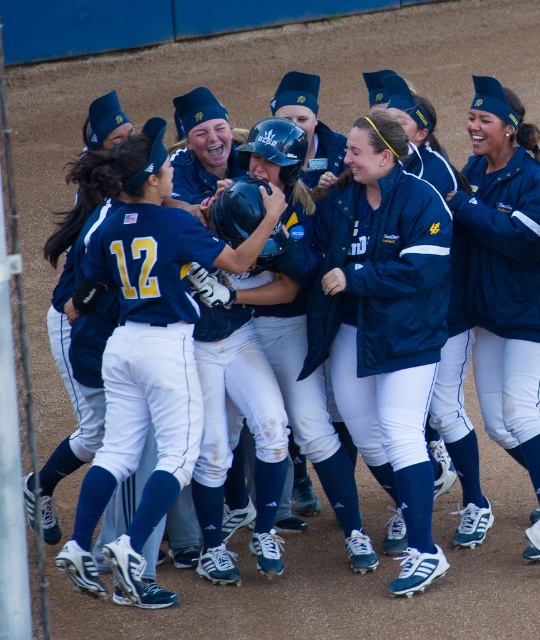
You are a photographer standing at the edge of the field. You want to take a photo of both the blue matte jacket at center and the matte blue jacket at center. Can you fit both in your camera frame if your camera has a 50 inch field of view?

The blue matte jacket at center is 38.21 inches away from the matte blue jacket at center. Since the distance between them is less than the camera frame of 50 inches, both can be captured in the same photo.

You are a photographer at the UCSD softball team celebration. You need to capture a photo where the navy blue jersey at center and the matte blue jacket at center are clearly visible. Which object should you focus on to ensure both are in the frame?

The navy blue jersey at center is positioned under the matte blue jacket at center, so focusing on the matte blue jacket at center will ensure both are visible in the photo.

You are a photographer at the event and want to capture a clear photo of both the blue matte jacket at center and the matte blue jacket at center. Which jacket should you focus on to ensure it appears larger in the photo?

The blue matte jacket at center is bigger than the matte blue jacket at center, so focusing on the blue matte jacket at center will ensure it appears larger in the photo.